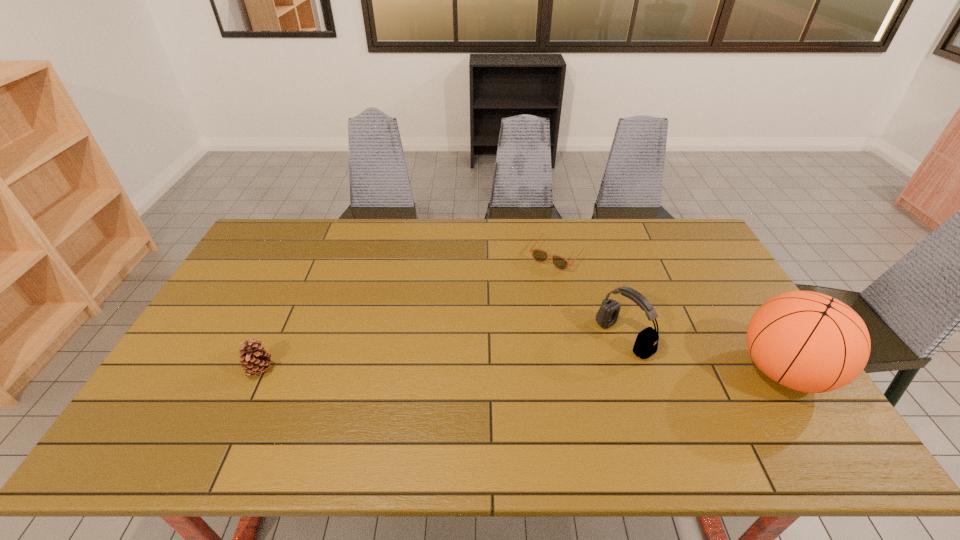
Locate an element on the screen. The image size is (960, 540). free space on the desktop that is between the pinecone and the basketball and is positioned on the headband of the third shortest object is located at coordinates (572, 370).

I want to click on free space on the desktop that is between the leftmost object and the tallest object and is positioned on the front-facing side of the farthest object, so click(469, 370).